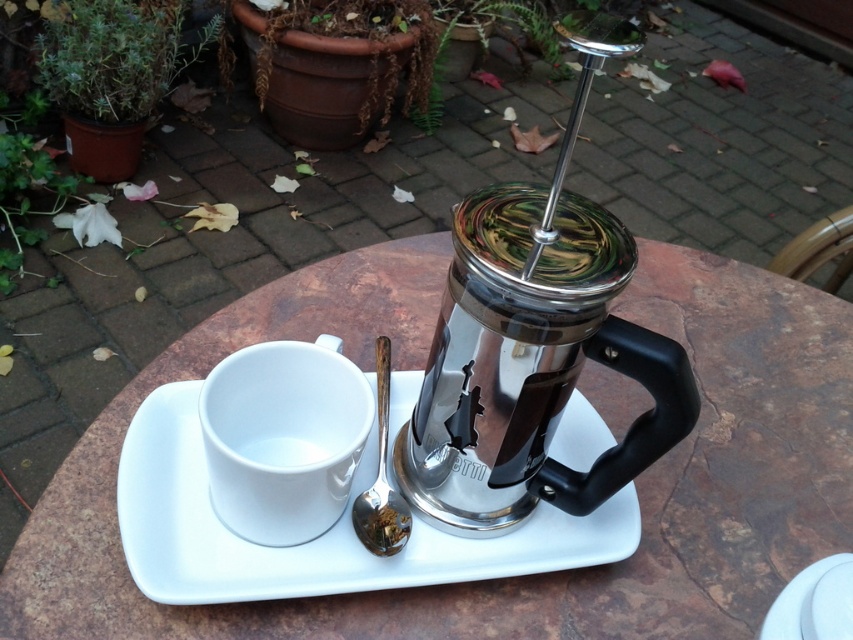
Question: Which point appears farthest from the camera in this image?

Choices:
 (A) (387, 500)
 (B) (345, 410)
 (C) (534, 557)

Answer: (C)

Question: Can you confirm if metallic brown table at center is wider than white glossy mug at center?

Choices:
 (A) yes
 (B) no

Answer: (A)

Question: Does metallic brown table at center lie in front of white glossy mug at center?

Choices:
 (A) no
 (B) yes

Answer: (A)

Question: Is metallic brown table at center above white ceramic mug at center?

Choices:
 (A) yes
 (B) no

Answer: (A)

Question: Which object is positioned closest to the white glossy mug at center?

Choices:
 (A) white ceramic saucer at center
 (B) satin silver spoon at lower center
 (C) white ceramic mug at center
 (D) metallic brown table at center

Answer: (C)

Question: Which of the following is the closest to the observer?

Choices:
 (A) white ceramic mug at center
 (B) white ceramic saucer at center
 (C) metallic brown table at center
 (D) satin silver spoon at lower center

Answer: (A)